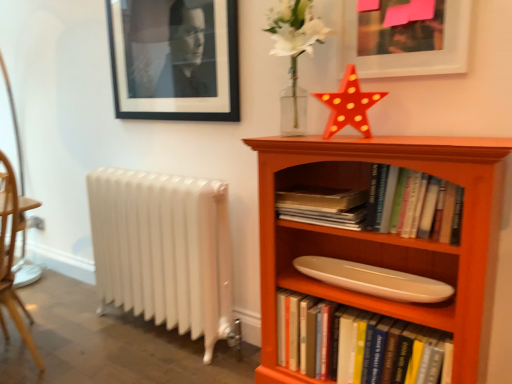
What are the coordinates of `free space on the front side of white metallic radiator at lower left` in the screenshot? It's located at (142, 362).